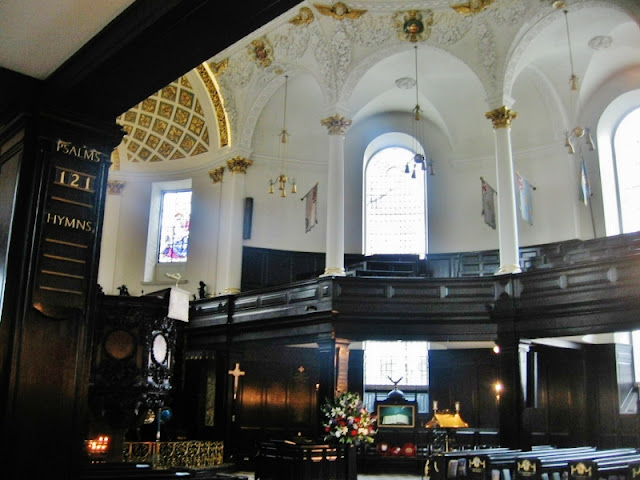
Where is `chandelier`? The height and width of the screenshot is (480, 640). chandelier is located at coordinates (284, 181), (578, 133), (419, 159).